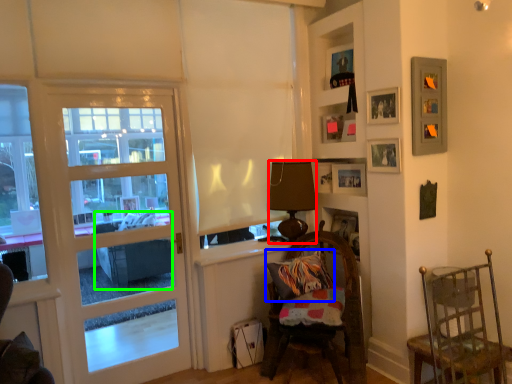
Question: Which object is the closest to the lamp (highlighted by a red box)? Choose among these: pillow (highlighted by a blue box) or studio couch (highlighted by a green box).

Choices:
 (A) pillow
 (B) studio couch

Answer: (A)